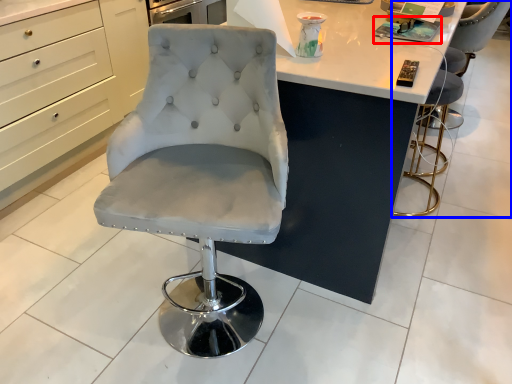
Question: Which point is further to the camera, magazine (highlighted by a red box) or chair (highlighted by a blue box)?

Choices:
 (A) magazine
 (B) chair

Answer: (B)